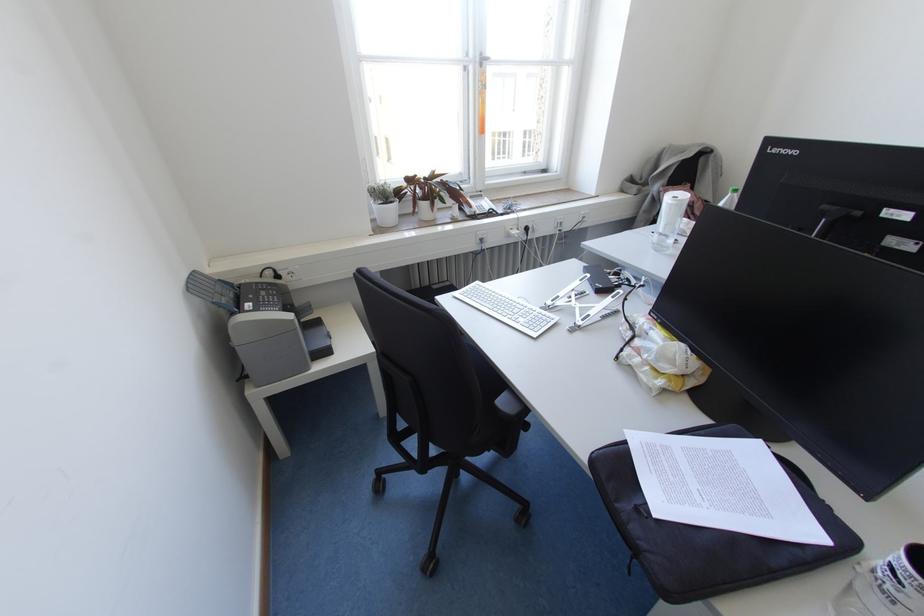
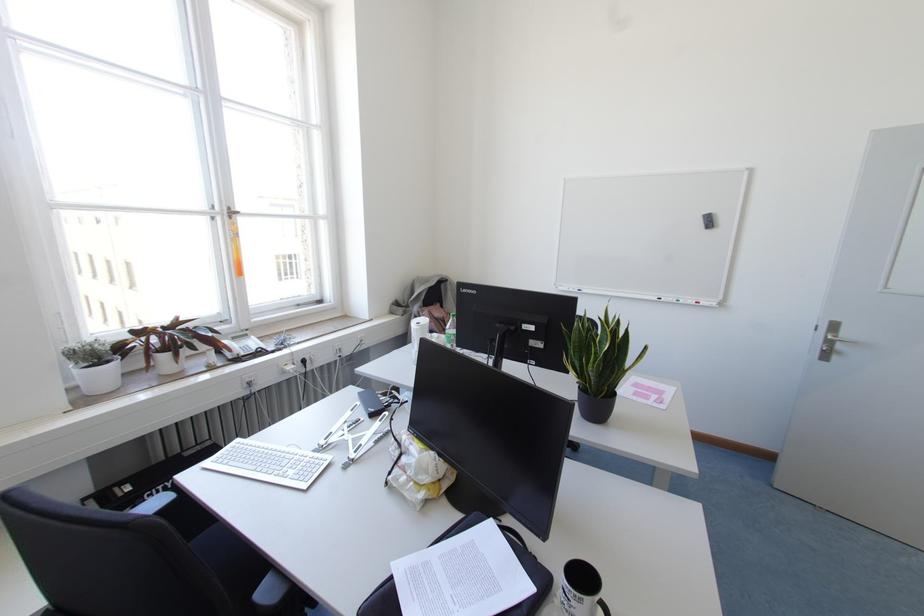
Where in the second image is the point corresponding to point (490, 209) from the first image?

(258, 349)